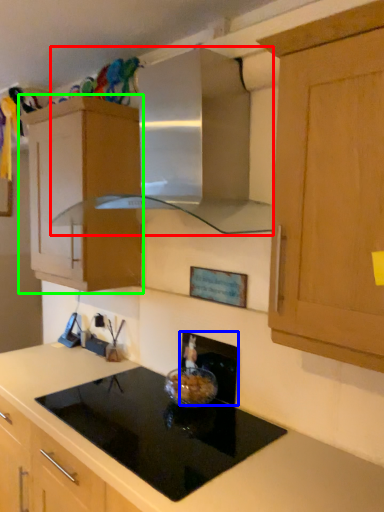
Question: Which is nearer to the vent (highlighted by a red box)? appliance (highlighted by a blue box) or cabinetry (highlighted by a green box).

Choices:
 (A) appliance
 (B) cabinetry

Answer: (B)